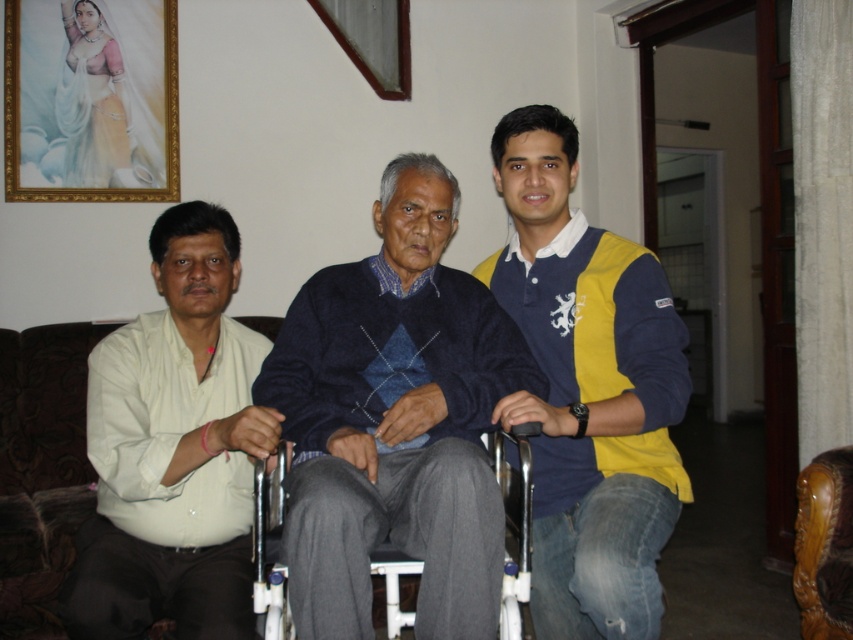
Between dark blue sweater at center and gold-framed portrait at upper left, which one has more height?

dark blue sweater at center is taller.

Which is above, dark blue sweater at center or gold-framed portrait at upper left?

gold-framed portrait at upper left is higher up.

Describe the element at coordinates (395, 420) in the screenshot. Image resolution: width=853 pixels, height=640 pixels. I see `dark blue sweater at center` at that location.

The image size is (853, 640). I want to click on dark blue sweater at center, so click(x=395, y=420).

Which is more to the left, yellow-blue polo shirt at center or gray fabric wheelchair at center?

gray fabric wheelchair at center

Is yellow-blue polo shirt at center thinner than gray fabric wheelchair at center?

Indeed, yellow-blue polo shirt at center has a lesser width compared to gray fabric wheelchair at center.

Is point (637, 576) less distant than point (405, 566)?

Yes, point (637, 576) is in front of point (405, 566).

Find the location of a particular element. The height and width of the screenshot is (640, 853). yellow-blue polo shirt at center is located at coordinates (589, 390).

Does yellow-blue polo shirt at center appear on the right side of brown leather chair at lower right?

No, yellow-blue polo shirt at center is not to the right of brown leather chair at lower right.

Where is `yellow-blue polo shirt at center`? yellow-blue polo shirt at center is located at coordinates (589, 390).

You are a GUI agent. You are given a task and a screenshot of the screen. Output one action in this format:
    pyautogui.click(x=<x>, y=<y>)
    Task: Click on the yellow-blue polo shirt at center
    
    Given the screenshot: What is the action you would take?
    pyautogui.click(x=589, y=390)